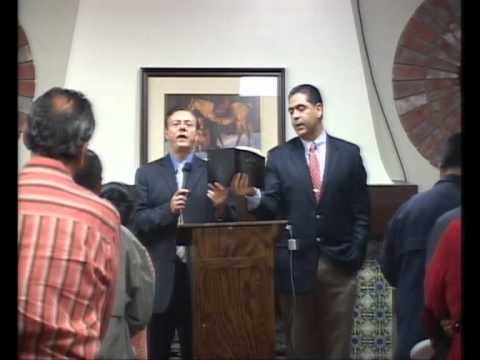
You are a GUI agent. You are given a task and a screenshot of the screen. Output one action in this format:
    pyautogui.click(x=<x>, y=<y>)
    Task: Click on the painting
    This screenshot has height=360, width=480.
    Given the screenshot: What is the action you would take?
    pyautogui.click(x=222, y=129)